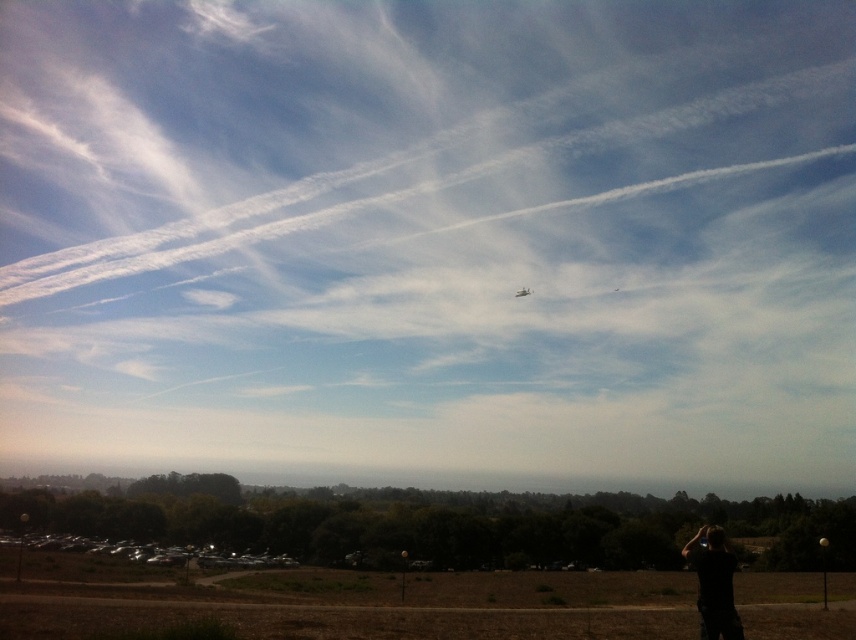
Between black fabric person at lower right and metallic silver airplane at center, which one is positioned lower?

Positioned lower is black fabric person at lower right.

Identify the location of black fabric person at lower right. The image size is (856, 640). (712, 582).

Image resolution: width=856 pixels, height=640 pixels. In order to click on black fabric person at lower right in this screenshot , I will do pyautogui.click(x=712, y=582).